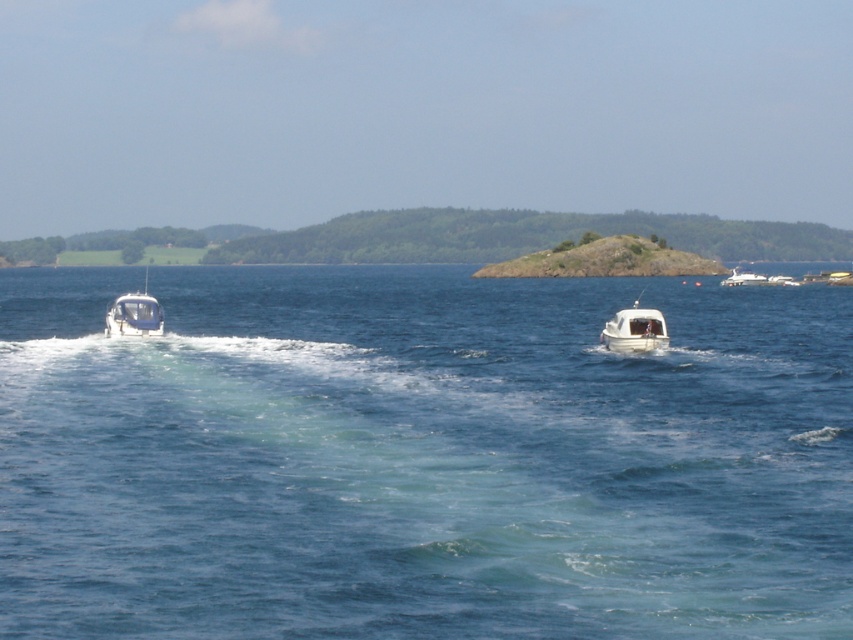
Who is shorter, white glossy boat at left or white glossy boat at right?

With less height is white glossy boat at left.

I want to click on white glossy boat at left, so click(x=134, y=314).

You are a GUI agent. You are given a task and a screenshot of the screen. Output one action in this format:
    pyautogui.click(x=<x>, y=<y>)
    Task: Click on the white glossy boat at left
    The height and width of the screenshot is (640, 853).
    Given the screenshot: What is the action you would take?
    pyautogui.click(x=134, y=314)

Between point (354, 346) and point (625, 337), which one is positioned behind?

Positioned behind is point (354, 346).

Where is `blue water at center`? The height and width of the screenshot is (640, 853). blue water at center is located at coordinates click(x=421, y=458).

Can you confirm if blue water at center is positioned below white glossy boat at right?

Yes, blue water at center is below white glossy boat at right.

Is blue water at center wider than white glossy boat at right?

Yes, blue water at center is wider than white glossy boat at right.

Who is more forward, (260,342) or (734,275)?

Point (260,342)

You are a GUI agent. You are given a task and a screenshot of the screen. Output one action in this format:
    pyautogui.click(x=<x>, y=<y>)
    Task: Click on the blue water at center
    
    Given the screenshot: What is the action you would take?
    pyautogui.click(x=421, y=458)